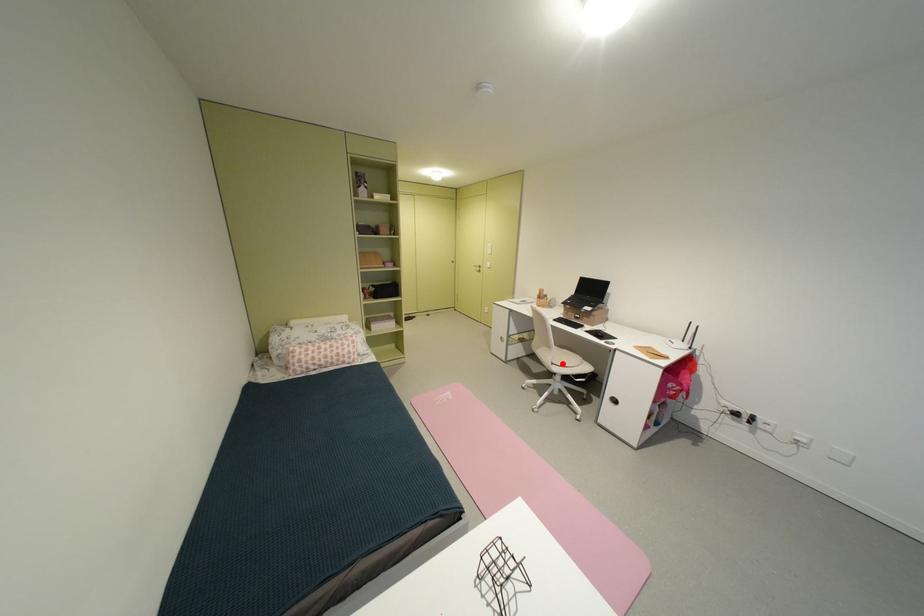
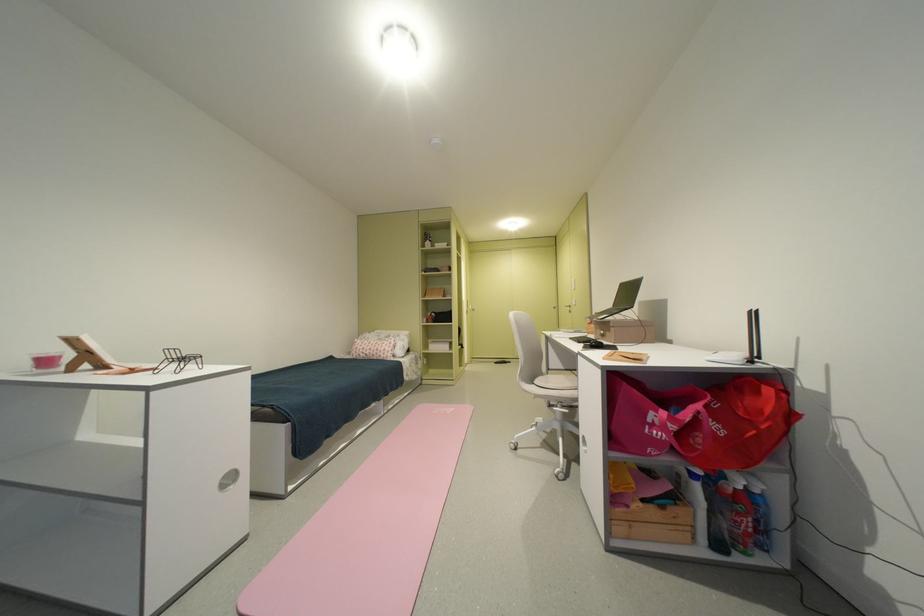
Find the pixel in the second image that matches the highlighted location in the first image.

(543, 383)